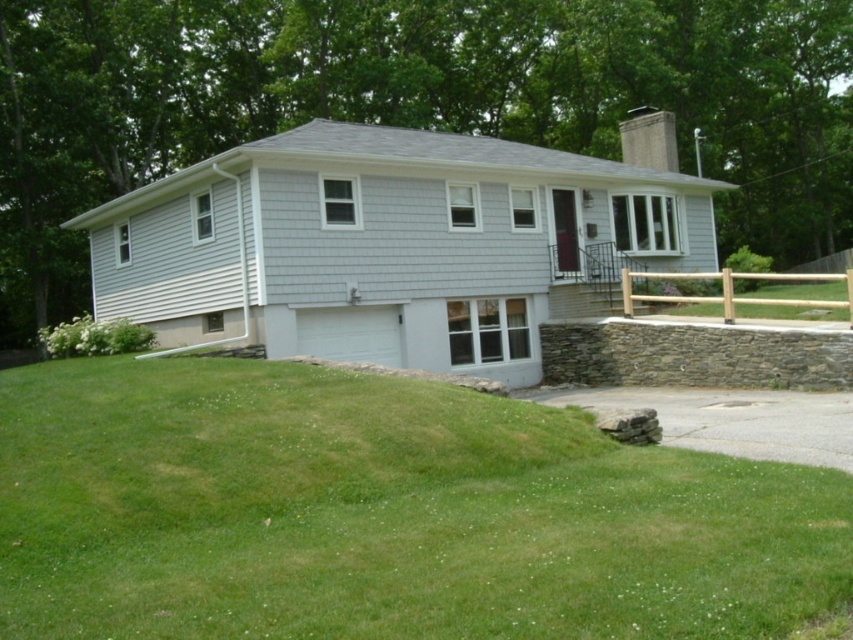
Does green grass at lower left lie behind gray asphalt driveway at lower right?

No, green grass at lower left is closer to the viewer.

The width and height of the screenshot is (853, 640). What do you see at coordinates (383, 515) in the screenshot? I see `green grass at lower left` at bounding box center [383, 515].

Is point (550, 438) closer to camera compared to point (791, 428)?

That is True.

Image resolution: width=853 pixels, height=640 pixels. I want to click on green grass at lower left, so click(383, 515).

Who is more forward, (816, 448) or (782, 304)?

Point (816, 448) is more forward.

Which is more to the left, gray asphalt driveway at lower right or brown wooden fence at right?

Positioned to the left is gray asphalt driveway at lower right.

Where is `gray asphalt driveway at lower right`? gray asphalt driveway at lower right is located at coordinates (733, 419).

This screenshot has height=640, width=853. Find the location of `gray asphalt driveway at lower right`. gray asphalt driveway at lower right is located at coordinates (733, 419).

Can you confirm if green grass at lower left is smaller than brown wooden fence at right?

Yes.

Between green grass at lower left and brown wooden fence at right, which one appears on the left side from the viewer's perspective?

From the viewer's perspective, green grass at lower left appears more on the left side.

At what (x,y) coordinates should I click in order to perform the action: click on green grass at lower left. Please return your answer as a coordinate pair (x, y). This screenshot has height=640, width=853. Looking at the image, I should click on (383, 515).

Locate an element on the screen. This screenshot has height=640, width=853. green grass at lower left is located at coordinates (383, 515).